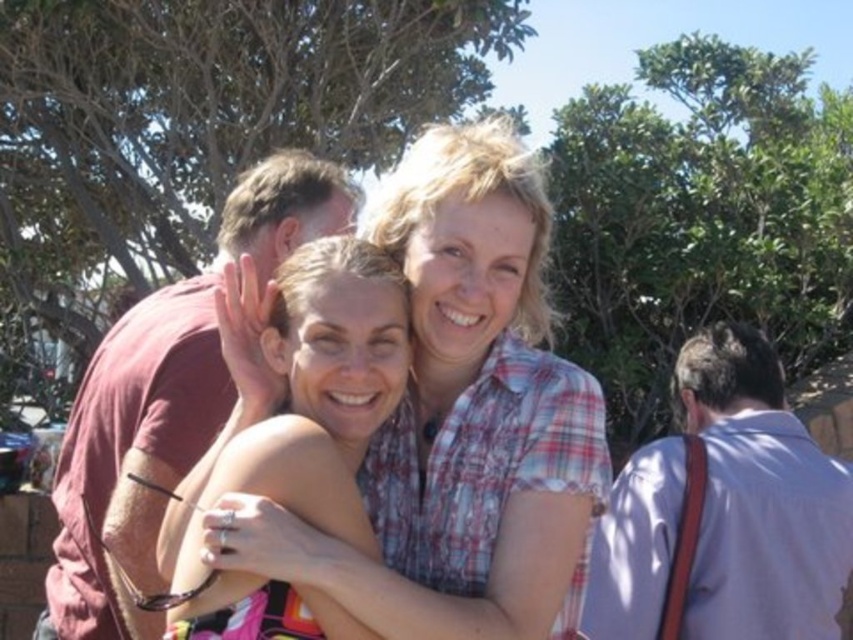
Question: Is the position of plaid shirt at center less distant than that of maroon cotton shirt at left?

Choices:
 (A) no
 (B) yes

Answer: (B)

Question: Where is light gray shirt at right located in relation to matte skin at center in the image?

Choices:
 (A) above
 (B) below

Answer: (B)

Question: Among these objects, which one is farthest from the camera?

Choices:
 (A) maroon cotton shirt at left
 (B) light gray shirt at right
 (C) plaid shirt at center

Answer: (B)

Question: Which object is positioned closest to the light gray shirt at right?

Choices:
 (A) maroon cotton shirt at left
 (B) plaid shirt at center

Answer: (B)

Question: Can you confirm if light gray shirt at right is positioned to the left of matte skin at center?

Choices:
 (A) yes
 (B) no

Answer: (B)

Question: Considering the real-world distances, which object is farthest from the maroon cotton shirt at left?

Choices:
 (A) matte skin at center
 (B) light gray shirt at right

Answer: (B)